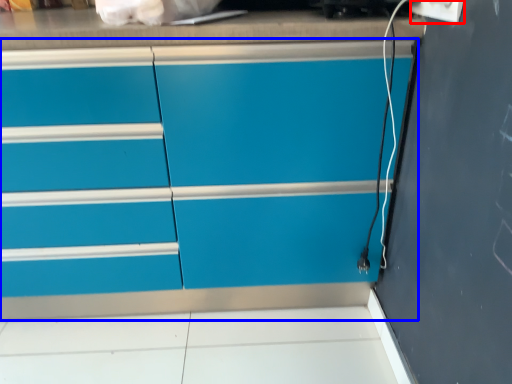
Question: Which object is closer to the camera taking this photo, electric outlet (highlighted by a red box) or chest of drawers (highlighted by a blue box)?

Choices:
 (A) electric outlet
 (B) chest of drawers

Answer: (A)